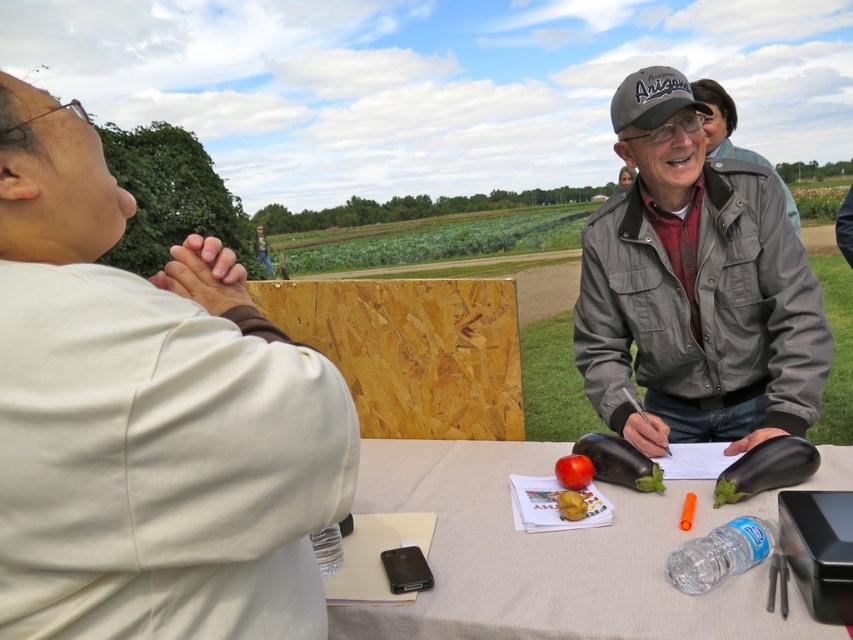
Is point (80, 467) less distant than point (576, 468)?

Yes, point (80, 467) is in front of point (576, 468).

Which of these two, white matte shirt at upper left or red matte tomato at center, stands shorter?

Standing shorter between the two is red matte tomato at center.

I want to click on white matte shirt at upper left, so point(148,417).

Is white matte shirt at upper left positioned behind white fabric table at center?

No.

Consider the image. Who is shorter, white matte shirt at upper left or white fabric table at center?

With less height is white fabric table at center.

Does point (13, 289) come closer to viewer compared to point (630, 604)?

Yes.

Identify the location of white matte shirt at upper left. (148, 417).

Is red matte tomato at center bigger than yellow matte potato at center?

Yes, red matte tomato at center is bigger than yellow matte potato at center.

Is point (560, 481) closer to viewer compared to point (566, 516)?

No, (560, 481) is behind (566, 516).

Between point (560, 465) and point (577, 499), which one is positioned in front?

Point (577, 499) is more forward.

Locate an element on the screen. red matte tomato at center is located at coordinates (573, 472).